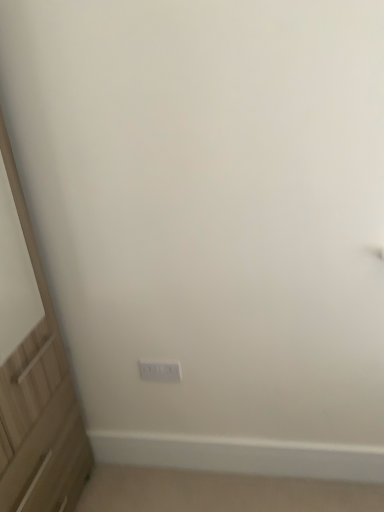
Locate an element on the screen. Image resolution: width=384 pixels, height=512 pixels. white plastic electric outlet at center is located at coordinates (160, 371).

What do you see at coordinates (160, 371) in the screenshot?
I see `white plastic electric outlet at center` at bounding box center [160, 371].

This screenshot has width=384, height=512. What do you see at coordinates (33, 372) in the screenshot?
I see `light wood screen door at left` at bounding box center [33, 372].

Identify the location of light wood screen door at left. (33, 372).

The height and width of the screenshot is (512, 384). In order to click on white plastic electric outlet at center in this screenshot , I will do `click(160, 371)`.

Would you say light wood screen door at left is to the left or to the right of white plastic electric outlet at center in the picture?

Based on their positions, light wood screen door at left is located to the left of white plastic electric outlet at center.

Is light wood screen door at left further to the viewer compared to white plastic electric outlet at center?

No, light wood screen door at left is closer to the viewer.

Does point (33, 510) come farther from viewer compared to point (150, 371)?

That is False.

From the image's perspective, between light wood screen door at left and white plastic electric outlet at center, which one is located above?

light wood screen door at left, from the image's perspective.

From a real-world perspective, which object rests below the other?

white plastic electric outlet at center, from a real-world perspective.

Considering the relative sizes of light wood screen door at left and white plastic electric outlet at center in the image provided, is light wood screen door at left thinner than white plastic electric outlet at center?

No.

Does light wood screen door at left have a greater height compared to white plastic electric outlet at center?

Indeed, light wood screen door at left has a greater height compared to white plastic electric outlet at center.

Which of these two, light wood screen door at left or white plastic electric outlet at center, is smaller?

With smaller size is white plastic electric outlet at center.

Is light wood screen door at left completely or partially outside of white plastic electric outlet at center?

Yes.

Is light wood screen door at left far away from white plastic electric outlet at center?

They are positioned close to each other.

Is light wood screen door at left aimed at white plastic electric outlet at center?

Yes, light wood screen door at left is oriented towards white plastic electric outlet at center.

Can you tell me how much light wood screen door at left and white plastic electric outlet at center differ in facing direction?

88.6 degrees separate the facing orientations of light wood screen door at left and white plastic electric outlet at center.

Locate an element on the screen. This screenshot has height=512, width=384. electric outlet on the right of light wood screen door at left is located at coordinates (160, 371).

Between white plastic electric outlet at center and light wood screen door at left, which one appears on the right side from the viewer's perspective?

From the viewer's perspective, white plastic electric outlet at center appears more on the right side.

In the scene shown: Does white plastic electric outlet at center come behind light wood screen door at left?

Yes, white plastic electric outlet at center is further from the camera.

Which point is more forward, (156, 375) or (25, 493)?

The point (25, 493) is closer.

From the image's perspective, between white plastic electric outlet at center and light wood screen door at left, which one is located above?

From the image's view, light wood screen door at left is above.

From a real-world perspective, is white plastic electric outlet at center above or below light wood screen door at left?

white plastic electric outlet at center is below light wood screen door at left.

Consider the image. Which of these two, white plastic electric outlet at center or light wood screen door at left, is wider?

light wood screen door at left.

Considering the sizes of objects white plastic electric outlet at center and light wood screen door at left in the image provided, who is taller, white plastic electric outlet at center or light wood screen door at left?

light wood screen door at left is taller.

Does white plastic electric outlet at center have a smaller size compared to light wood screen door at left?

Indeed, white plastic electric outlet at center has a smaller size compared to light wood screen door at left.

Is white plastic electric outlet at center outside of light wood screen door at left?

Indeed, white plastic electric outlet at center is completely outside light wood screen door at left.

Are white plastic electric outlet at center and light wood screen door at left beside each other?

There is a gap between white plastic electric outlet at center and light wood screen door at left.

Is light wood screen door at left at the back of white plastic electric outlet at center?

No, white plastic electric outlet at center is not facing away from light wood screen door at left.

From the picture: Can you tell me how much white plastic electric outlet at center and light wood screen door at left differ in facing direction?

The facing directions of white plastic electric outlet at center and light wood screen door at left are 88.6 degrees apart.

Where is `electric outlet beneath the light wood screen door at left (from a real-world perspective)`? Image resolution: width=384 pixels, height=512 pixels. electric outlet beneath the light wood screen door at left (from a real-world perspective) is located at coordinates (160, 371).

Find the location of `electric outlet below the light wood screen door at left (from a real-world perspective)`. electric outlet below the light wood screen door at left (from a real-world perspective) is located at coordinates (160, 371).

The height and width of the screenshot is (512, 384). Identify the location of electric outlet that is behind the light wood screen door at left. (160, 371).